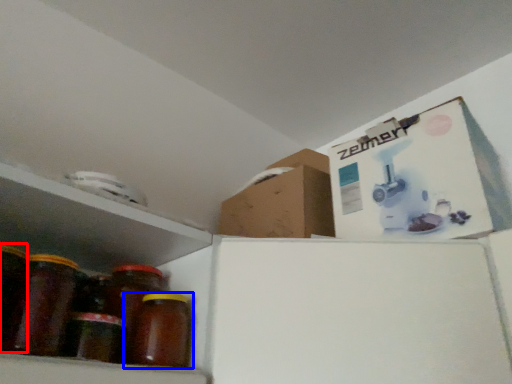
Question: Which of the following is the farthest to the observer, glass jar (highlighted by a red box) or bottle (highlighted by a blue box)?

Choices:
 (A) glass jar
 (B) bottle

Answer: (B)